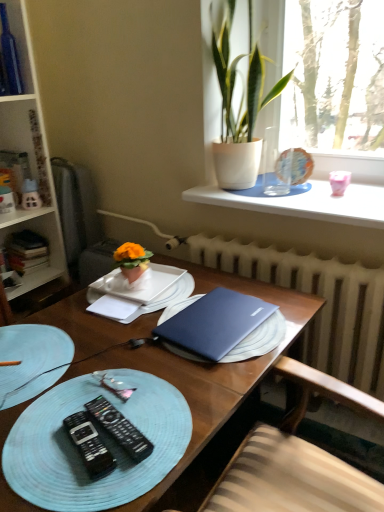
I want to click on vacant space situated above light blue woven placemat at lower left (from a real-world perspective), so click(x=101, y=422).